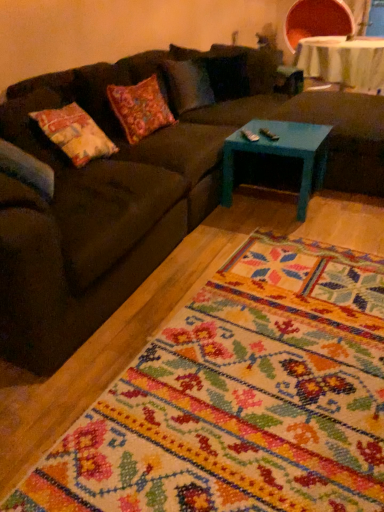
The width and height of the screenshot is (384, 512). Describe the element at coordinates (280, 153) in the screenshot. I see `teal painted wood coffee table at center` at that location.

In order to face floral carpet at center, should I rotate leftwards or rightwards?

To face it directly, rotate right by 10.653 degrees.

At what (x,y) coordinates should I click in order to perform the action: click on teal painted wood coffee table at center. Please return your answer as a coordinate pair (x, y). The width and height of the screenshot is (384, 512). Looking at the image, I should click on (280, 153).

From the image's perspective, is teal painted wood coffee table at center beneath white fabric table at upper right?

Yes, from the image's perspective, teal painted wood coffee table at center is beneath white fabric table at upper right.

Is teal painted wood coffee table at center aimed at white fabric table at upper right?

No, teal painted wood coffee table at center is not aimed at white fabric table at upper right.

Consider the image. Considering the sizes of teal painted wood coffee table at center and white fabric table at upper right in the image, is teal painted wood coffee table at center wider or thinner than white fabric table at upper right?

teal painted wood coffee table at center is thinner than white fabric table at upper right.

Who is taller, teal painted wood coffee table at center or white fabric table at upper right?

With more height is white fabric table at upper right.

Between point (153, 423) and point (287, 170), which one is positioned behind?

The point (287, 170) is farther from the camera.

Can you confirm if floral carpet at center is smaller than dark brown fabric couch at center?

Indeed, floral carpet at center has a smaller size compared to dark brown fabric couch at center.

Does floral carpet at center appear on the right side of dark brown fabric couch at center?

Yes, floral carpet at center is to the right of dark brown fabric couch at center.

Where is `mat beneath the dark brown fabric couch at center (from a real-world perspective)`? The image size is (384, 512). mat beneath the dark brown fabric couch at center (from a real-world perspective) is located at coordinates (240, 398).

Consider the image. Could you tell me if teal painted wood footrest at center is turned towards teal painted wood coffee table at center?

No.

Consider the image. How many degrees apart are the facing directions of teal painted wood footrest at center and teal painted wood coffee table at center?

0.284 degrees separate the facing orientations of teal painted wood footrest at center and teal painted wood coffee table at center.

Identify the location of the footrest that appears above the teal painted wood coffee table at center (from the image's perspective). The height and width of the screenshot is (512, 384). (344, 136).

Is white fabric table at upper right turned away from dark brown fabric couch at center?

No.

From the image's perspective, between white fabric table at upper right and dark brown fabric couch at center, which one is located above?

From the image's view, white fabric table at upper right is above.

Is white fabric table at upper right positioned far away from dark brown fabric couch at center?

That's right, there is a large distance between white fabric table at upper right and dark brown fabric couch at center.

Can you confirm if white fabric table at upper right is taller than dark brown fabric couch at center?

No.

From a real-world perspective, is white fabric table at upper right on top of teal painted wood coffee table at center?

Yes, from a real-world perspective, white fabric table at upper right is on top of teal painted wood coffee table at center.

Is point (317, 71) less distant than point (255, 119)?

No.

You are a GUI agent. You are given a task and a screenshot of the screen. Output one action in this format:
    pyautogui.click(x=<x>, y=<y>)
    Task: Click on the coffee table below the white fabric table at upper right (from the image's perspective)
    
    Given the screenshot: What is the action you would take?
    pyautogui.click(x=280, y=153)

Can you tell me how much teal painted wood footrest at center and white fabric table at upper right differ in facing direction?

The angular difference between teal painted wood footrest at center and white fabric table at upper right is 0.283 degrees.

Looking at this image, is teal painted wood footrest at center smaller than white fabric table at upper right?

Yes, teal painted wood footrest at center is smaller than white fabric table at upper right.

Does teal painted wood footrest at center have a lesser width compared to white fabric table at upper right?

Indeed, teal painted wood footrest at center has a lesser width compared to white fabric table at upper right.

Could you tell me if teal painted wood footrest at center is facing white fabric table at upper right?

No, teal painted wood footrest at center is not turned towards white fabric table at upper right.

Between floral carpet at center and teal painted wood footrest at center, which one appears on the right side from the viewer's perspective?

From the viewer's perspective, teal painted wood footrest at center appears more on the right side.

The image size is (384, 512). In order to click on mat in front of the teal painted wood footrest at center in this screenshot , I will do [240, 398].

Can you confirm if floral carpet at center is taller than teal painted wood footrest at center?

Incorrect, the height of floral carpet at center is not larger of that of teal painted wood footrest at center.

From a real-world perspective, does floral carpet at center sit lower than teal painted wood footrest at center?

Yes.

Locate an element on the screen. This screenshot has width=384, height=512. table that is on the right side of teal painted wood coffee table at center is located at coordinates (343, 61).

This screenshot has width=384, height=512. In order to click on studio couch that appears above the floral carpet at center (from a real-world perspective) in this screenshot , I will do `click(107, 201)`.

Which object lies further to the anchor point dark brown fabric couch at center, teal painted wood footrest at center or teal painted wood coffee table at center?

teal painted wood footrest at center is further to dark brown fabric couch at center.

Consider the image. Which object lies further to the anchor point white fabric table at upper right, teal painted wood footrest at center or floral carpet at center?

Among the two, floral carpet at center is located further to white fabric table at upper right.

Which object lies further to the anchor point floral carpet at center, white fabric table at upper right or teal painted wood footrest at center?

white fabric table at upper right.

From the picture: When comparing their distances from teal painted wood footrest at center, does white fabric table at upper right or teal painted wood coffee table at center seem closer?

The object closer to teal painted wood footrest at center is teal painted wood coffee table at center.

When comparing their distances from floral carpet at center, does white fabric table at upper right or teal painted wood coffee table at center seem further?

Among the two, white fabric table at upper right is located further to floral carpet at center.

Which object lies nearer to the anchor point teal painted wood coffee table at center, white fabric table at upper right or teal painted wood footrest at center?

teal painted wood footrest at center is positioned closer to the anchor teal painted wood coffee table at center.

Looking at the image, which one is located closer to teal painted wood coffee table at center, white fabric table at upper right or floral carpet at center?

floral carpet at center lies closer to teal painted wood coffee table at center than the other object.

From the image, which object appears to be farther from white fabric table at upper right, floral carpet at center or dark brown fabric couch at center?

Among the two, floral carpet at center is located further to white fabric table at upper right.

Where is `coffee table located between floral carpet at center and white fabric table at upper right in the depth direction`? The width and height of the screenshot is (384, 512). coffee table located between floral carpet at center and white fabric table at upper right in the depth direction is located at coordinates (280, 153).

What are the coordinates of `the footrest positioned between dark brown fabric couch at center and white fabric table at upper right from near to far` in the screenshot? It's located at (344, 136).

Find the location of a particular element. This screenshot has height=512, width=384. studio couch positioned between floral carpet at center and white fabric table at upper right from near to far is located at coordinates (107, 201).

Where is `coffee table located between floral carpet at center and teal painted wood footrest at center in the depth direction`? The image size is (384, 512). coffee table located between floral carpet at center and teal painted wood footrest at center in the depth direction is located at coordinates (280, 153).